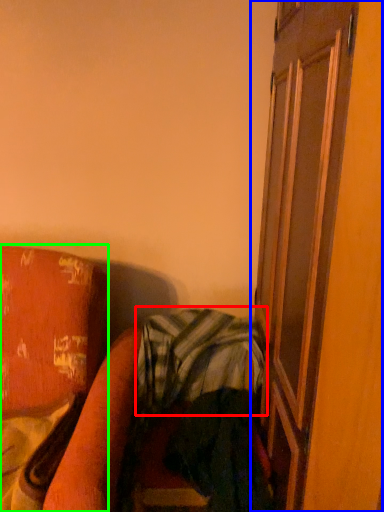
Question: Estimate the real-world distances between objects in this image. Which object is farther from plaid (highlighted by a red box), screen door (highlighted by a blue box) or furniture (highlighted by a green box)?

Choices:
 (A) screen door
 (B) furniture

Answer: (A)